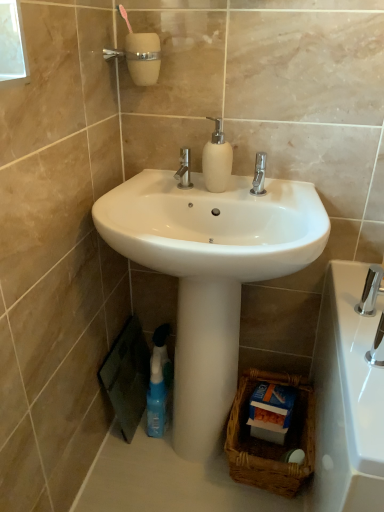
Find the location of a particular element. vacant space to the left of matte white soap dispenser at center is located at coordinates (170, 190).